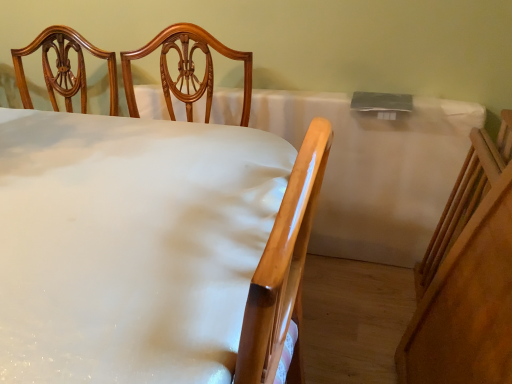
Question: Is white glossy bed at center positioned beyond the bounds of white matte tablecloth at center?

Choices:
 (A) yes
 (B) no

Answer: (A)

Question: Is white glossy bed at center directly adjacent to white matte tablecloth at center?

Choices:
 (A) yes
 (B) no

Answer: (B)

Question: Considering the relative sizes of white glossy bed at center and white matte tablecloth at center in the image provided, is white glossy bed at center taller than white matte tablecloth at center?

Choices:
 (A) yes
 (B) no

Answer: (A)

Question: Can you confirm if white glossy bed at center is positioned to the left of white matte tablecloth at center?

Choices:
 (A) yes
 (B) no

Answer: (A)

Question: Does white glossy bed at center turn towards white matte tablecloth at center?

Choices:
 (A) yes
 (B) no

Answer: (B)

Question: Is the position of white glossy bed at center more distant than that of white matte tablecloth at center?

Choices:
 (A) no
 (B) yes

Answer: (A)

Question: Is white matte tablecloth at center at the left side of white glossy bed at center?

Choices:
 (A) yes
 (B) no

Answer: (B)

Question: Does white matte tablecloth at center have a larger size compared to white glossy bed at center?

Choices:
 (A) yes
 (B) no

Answer: (B)

Question: Would you say white glossy bed at center is part of white matte tablecloth at center's contents?

Choices:
 (A) yes
 (B) no

Answer: (B)

Question: Considering the relative sizes of white matte tablecloth at center and white glossy bed at center in the image provided, is white matte tablecloth at center shorter than white glossy bed at center?

Choices:
 (A) yes
 (B) no

Answer: (A)

Question: From a real-world perspective, is white matte tablecloth at center physically above white glossy bed at center?

Choices:
 (A) yes
 (B) no

Answer: (B)

Question: Is white matte tablecloth at center looking in the opposite direction of white glossy bed at center?

Choices:
 (A) no
 (B) yes

Answer: (A)

Question: Considering the positions of white glossy bed at center and white matte tablecloth at center in the image, is white glossy bed at center taller or shorter than white matte tablecloth at center?

Choices:
 (A) tall
 (B) short

Answer: (A)